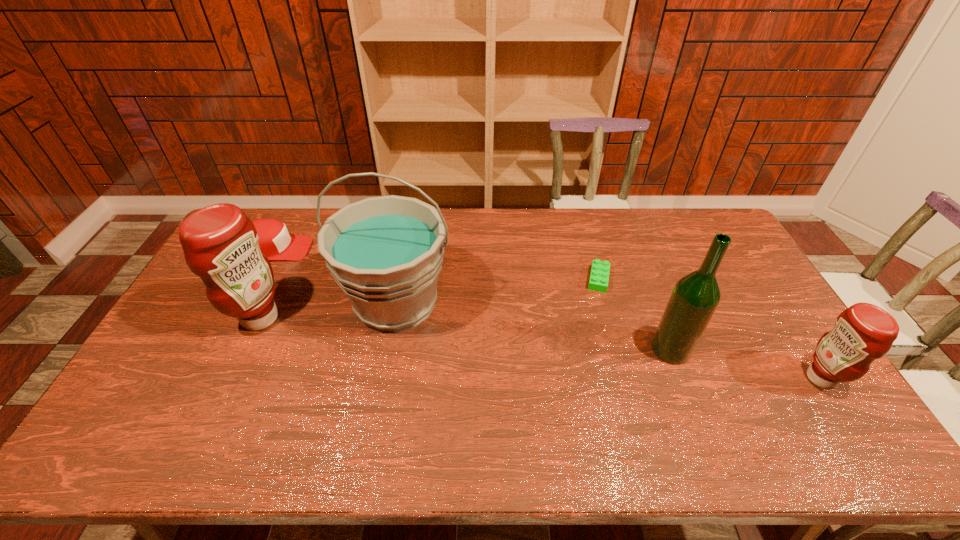
What are the coordinates of `vacant area that lies between the bucket and the farther condiment` in the screenshot? It's located at (328, 310).

This screenshot has height=540, width=960. Identify the location of unoccupied area between the farthest object and the alcohol. (472, 299).

Find the location of `free space between the bucket and the right condiment`. free space between the bucket and the right condiment is located at coordinates (609, 340).

In order to click on vacant space that's between the third object from left to right and the shortest object in this screenshot , I will do `click(497, 291)`.

You are a GUI agent. You are given a task and a screenshot of the screen. Output one action in this format:
    pyautogui.click(x=<x>, y=<y>)
    Task: Click on the free point between the shortest object and the second object from right to left
    The width and height of the screenshot is (960, 540).
    Given the screenshot: What is the action you would take?
    pyautogui.click(x=635, y=314)

Point out which object is positioned as the fourth nearest to the fifth tallest object. Please provide its 2D coordinates. Your answer should be formatted as a tuple, i.e. [(x, y)], where the tuple contains the x and y coordinates of a point satisfying the conditions above.

[(695, 297)]

Locate which object ranks fifth in proximity to the third shortest object. Please provide its 2D coordinates. Your answer should be formatted as a tuple, i.e. [(x, y)], where the tuple contains the x and y coordinates of a point satisfying the conditions above.

[(274, 241)]

This screenshot has width=960, height=540. I want to click on vacant region that satisfies the following two spatial constraints: 1. on the front-facing side of the baseball cap; 2. on the left side of the right condiment, so click(x=208, y=378).

Identify the location of vacant region that satisfies the following two spatial constraints: 1. on the front-facing side of the second shortest object; 2. on the right side of the alcohol. (224, 349).

Image resolution: width=960 pixels, height=540 pixels. Identify the location of vacant space that satisfies the following two spatial constraints: 1. on the front-facing side of the farthest object; 2. on the back side of the alcohol. (224, 349).